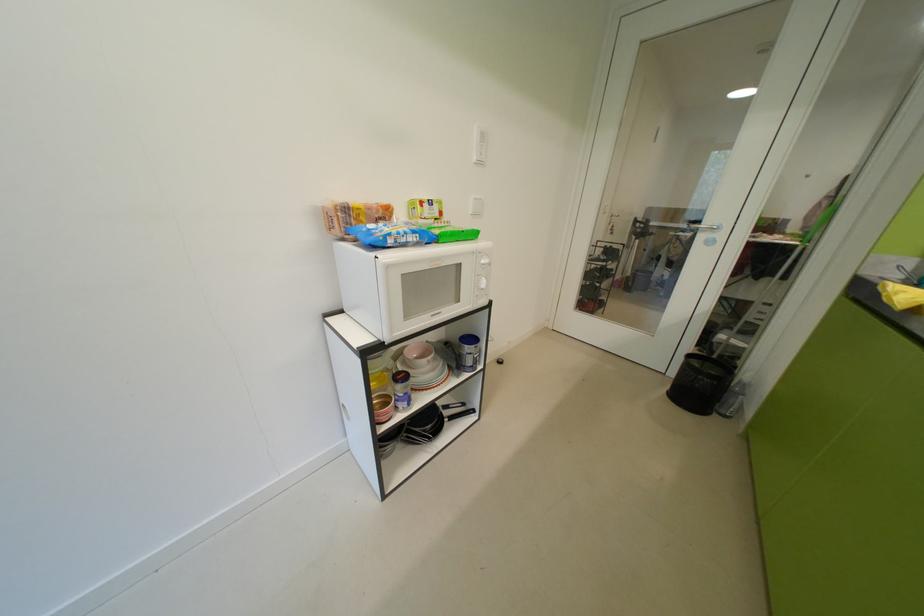
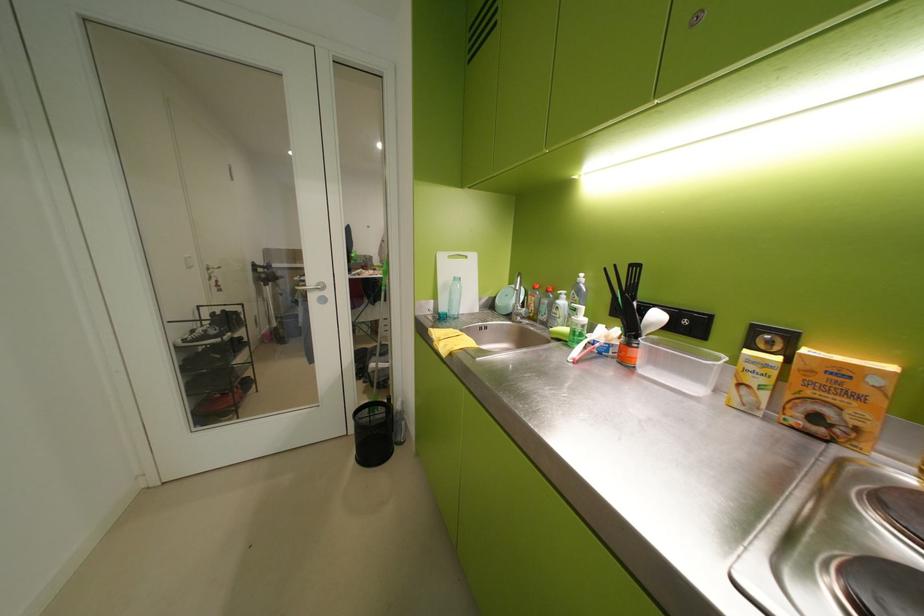
Find the pixel in the second image that matches (x=684, y=374) in the first image.

(363, 432)